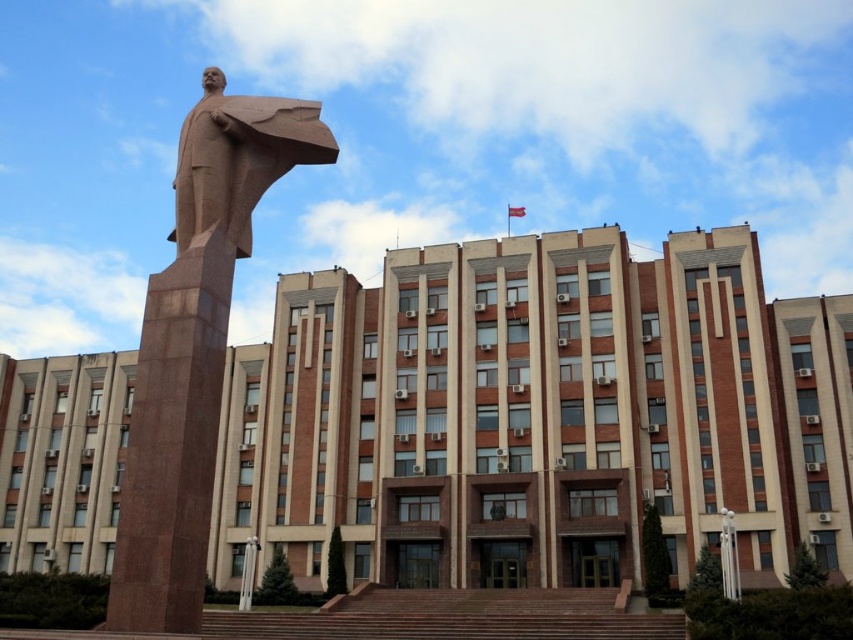
Is brown polished stone statue at left to the right of brown stone statue at left from the viewer's perspective?

No, brown polished stone statue at left is not to the right of brown stone statue at left.

Who is more forward, (186,212) or (247,170)?

Positioned in front is point (186,212).

What do you see at coordinates (195, 348) in the screenshot? This screenshot has height=640, width=853. I see `brown polished stone statue at left` at bounding box center [195, 348].

Image resolution: width=853 pixels, height=640 pixels. In order to click on brown polished stone statue at left in this screenshot , I will do `click(195, 348)`.